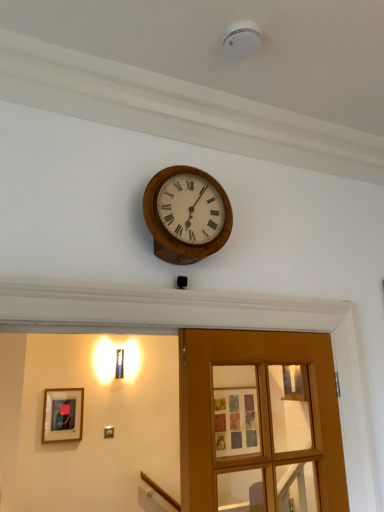
Question: In terms of height, does wooden wall clock at upper center look taller or shorter compared to wooden framed picture at lower left?

Choices:
 (A) short
 (B) tall

Answer: (A)

Question: From the image's perspective, is wooden wall clock at upper center above or below wooden framed picture at lower left?

Choices:
 (A) below
 (B) above

Answer: (B)

Question: Which is farther from the wooden glass door at center?

Choices:
 (A) wooden framed picture at lower left
 (B) wooden wall clock at upper center

Answer: (A)

Question: Which object is positioned farthest from the wooden wall clock at upper center?

Choices:
 (A) wooden framed picture at lower left
 (B) wooden glass door at center

Answer: (A)